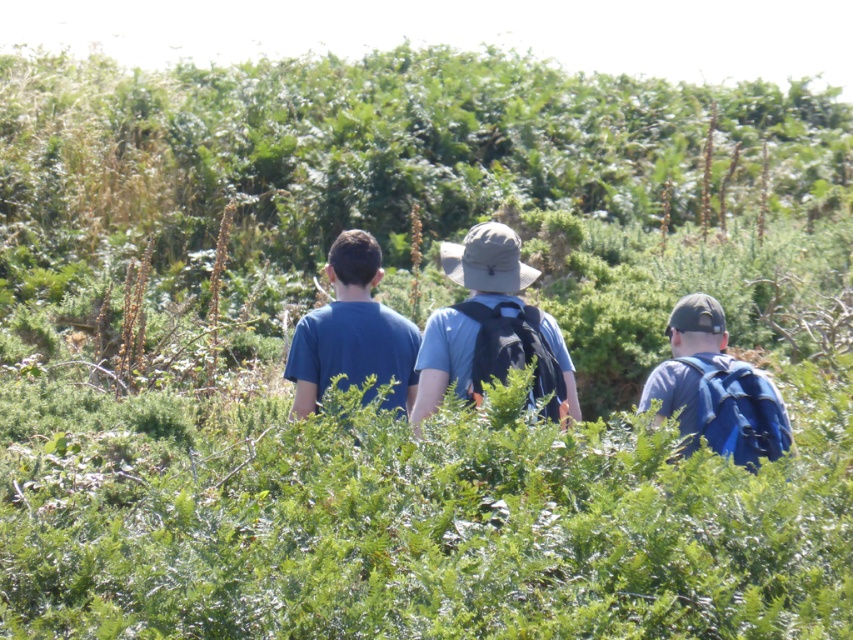
Is blue fabric backpack at right to the right of blue matte shirt at center from the viewer's perspective?

Yes, blue fabric backpack at right is to the right of blue matte shirt at center.

What do you see at coordinates (715, 388) in the screenshot?
I see `blue fabric backpack at right` at bounding box center [715, 388].

This screenshot has width=853, height=640. I want to click on blue fabric backpack at right, so click(715, 388).

Which of these two, matte blue shirt at center or blue matte shirt at center, stands taller?

blue matte shirt at center is taller.

Is matte blue shirt at center below blue matte shirt at center?

No.

Is point (502, 291) more distant than point (408, 339)?

That is False.

Identify the location of matte blue shirt at center. (491, 328).

Is matte blue shirt at center behind blue fabric backpack at right?

No, matte blue shirt at center is in front of blue fabric backpack at right.

How much distance is there between matte blue shirt at center and blue fabric backpack at right?

A distance of 79.97 centimeters exists between matte blue shirt at center and blue fabric backpack at right.

Describe the element at coordinates (491, 328) in the screenshot. I see `matte blue shirt at center` at that location.

Locate an element on the screen. The width and height of the screenshot is (853, 640). matte blue shirt at center is located at coordinates (491, 328).